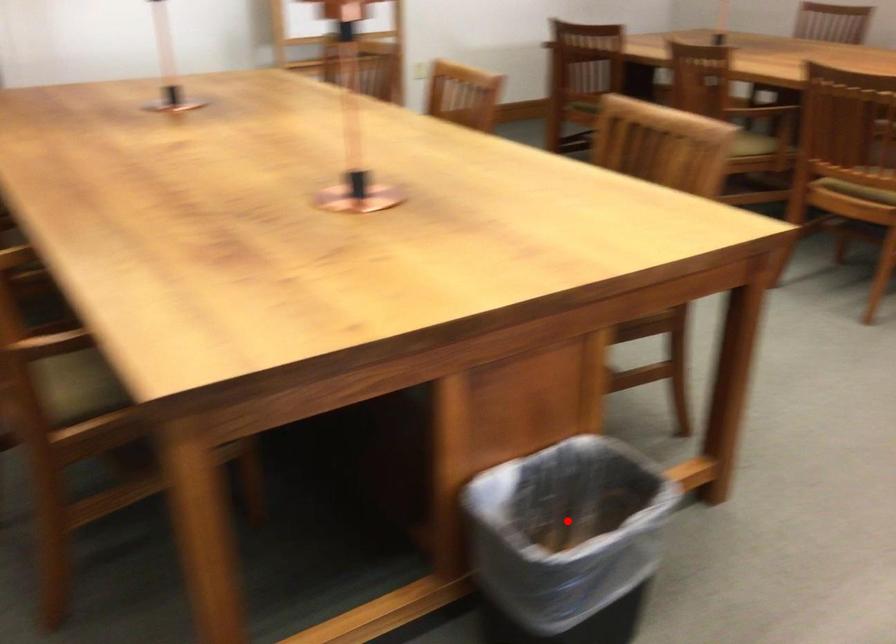
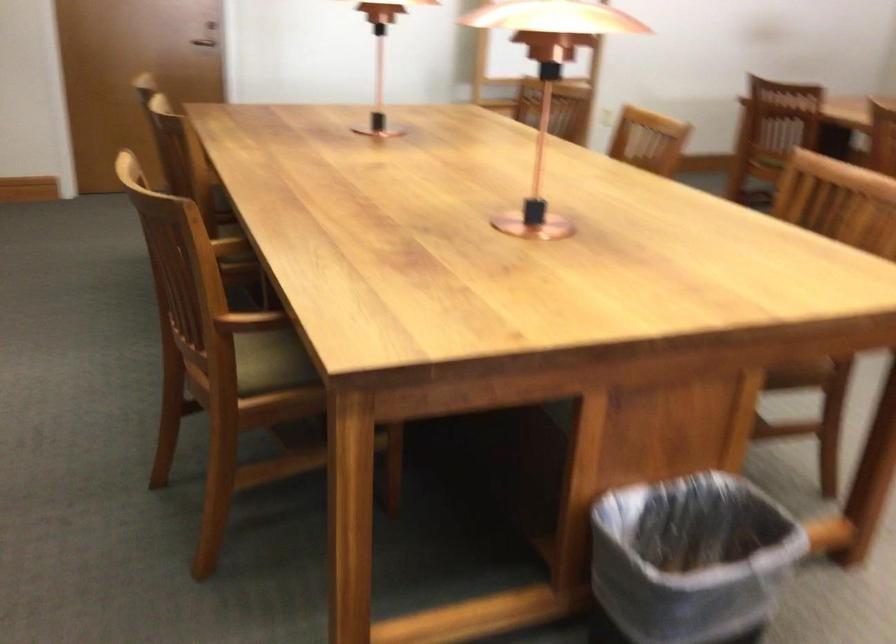
The point at the highlighted location is marked in the first image. Where is the corresponding point in the second image?

(691, 560)